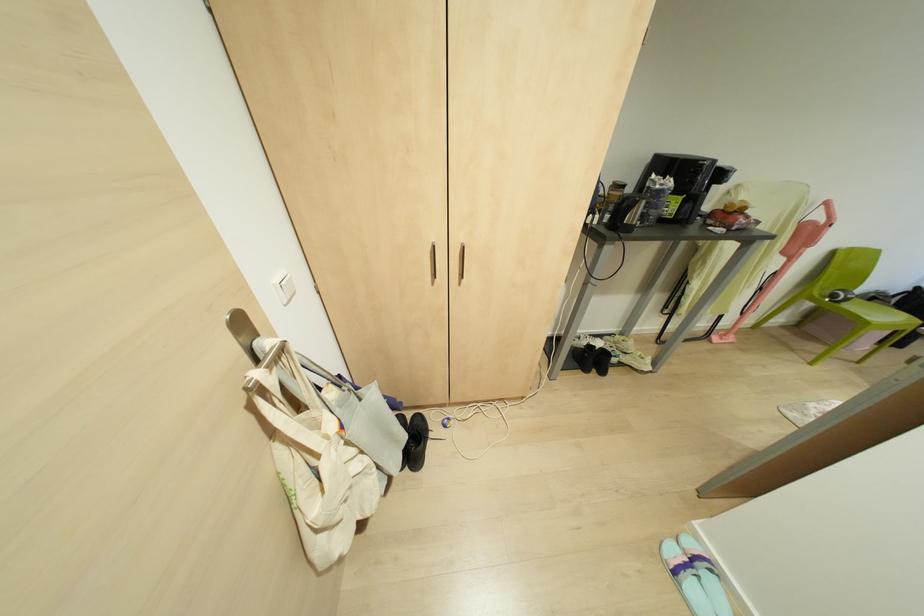
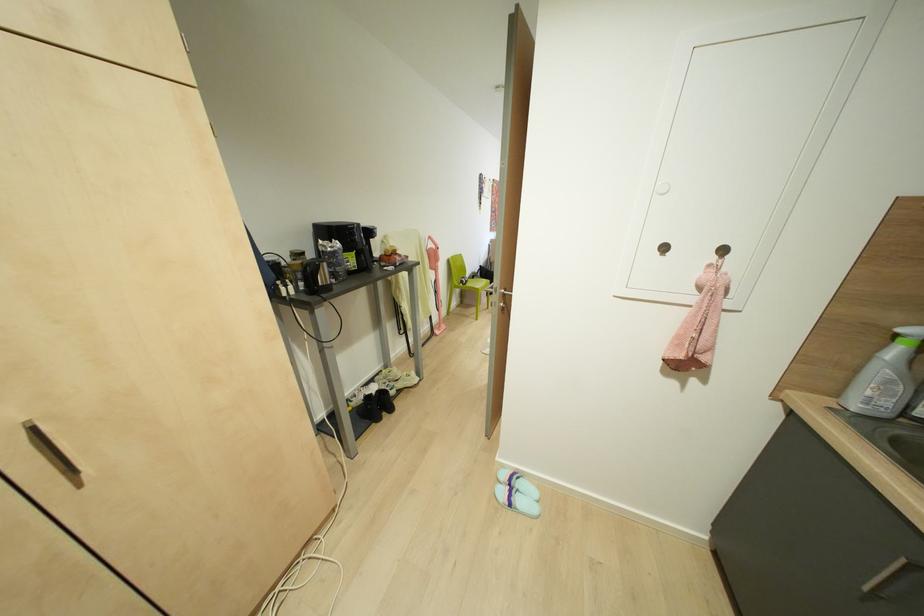
Question: The images are taken continuously from a first-person perspective. In which direction is your viewpoint rotating?

Choices:
 (A) Left
 (B) Right
 (C) Up
 (D) Down

Answer: (B)